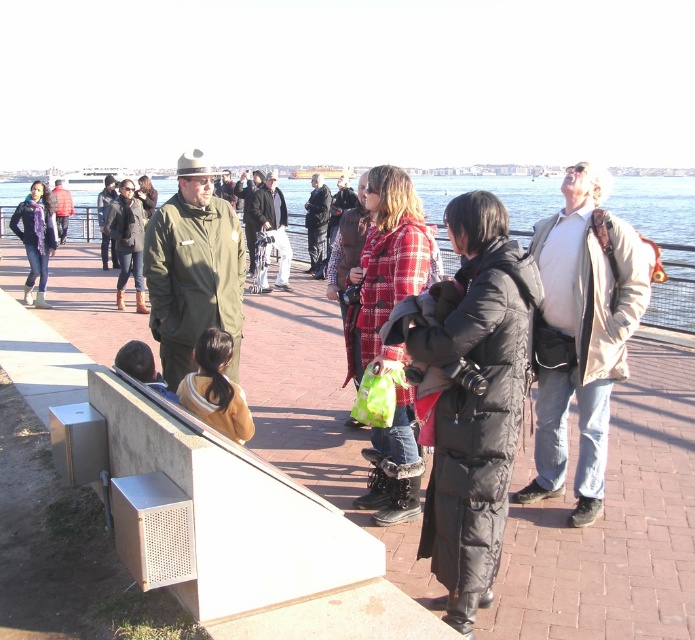
Question: Which of these objects is positioned closest to the yellow fabric jacket at lower left?

Choices:
 (A) khaki uniform at center
 (B) dark gray uniform at center

Answer: (A)

Question: Is black puffy coat at center positioned at the back of plaid wool coat at center?

Choices:
 (A) no
 (B) yes

Answer: (A)

Question: Estimate the real-world distances between objects in this image. Which object is farther from the dark gray uniform at center?

Choices:
 (A) light brown leather jacket at upper right
 (B) plaid wool coat at center
 (C) green matte jacket at center
 (D) matte black jacket at left

Answer: (A)

Question: Can you confirm if black puffy coat at center is positioned to the right of dark gray uniform at center?

Choices:
 (A) yes
 (B) no

Answer: (A)

Question: Does plaid wool coat at center have a smaller size compared to dark gray uniform at center?

Choices:
 (A) yes
 (B) no

Answer: (B)

Question: Which point is farther to the camera?

Choices:
 (A) (24, 282)
 (B) (278, 275)
 (C) (432, 332)

Answer: (B)